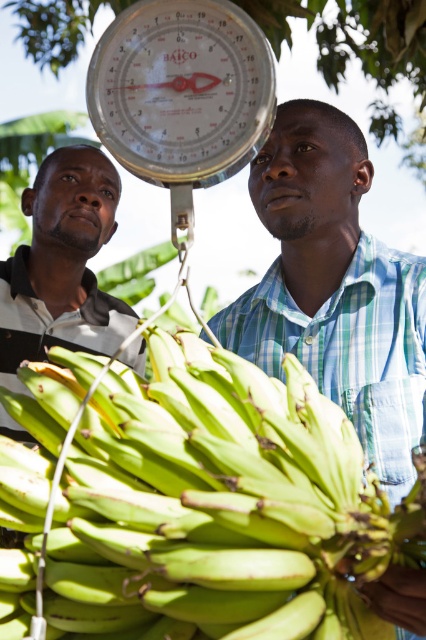
Question: Which object is the closest to the green matte bananas at center?

Choices:
 (A) white metallic scale at center
 (B) green plaid shirt at center
 (C) striped cotton shirt at left

Answer: (A)

Question: Can you confirm if green matte bananas at center is wider than striped cotton shirt at left?

Choices:
 (A) no
 (B) yes

Answer: (A)

Question: Which point is closer to the camera taking this photo?

Choices:
 (A) (347, 308)
 (B) (123, 12)

Answer: (B)

Question: Estimate the real-world distances between objects in this image. Which object is closer to the green matte bananas at center?

Choices:
 (A) green plaid shirt at center
 (B) striped cotton shirt at left

Answer: (A)

Question: Is green matte bananas at center positioned at the back of white metallic scale at center?

Choices:
 (A) no
 (B) yes

Answer: (A)

Question: Can you confirm if green plaid shirt at center is positioned below white metallic scale at center?

Choices:
 (A) yes
 (B) no

Answer: (A)